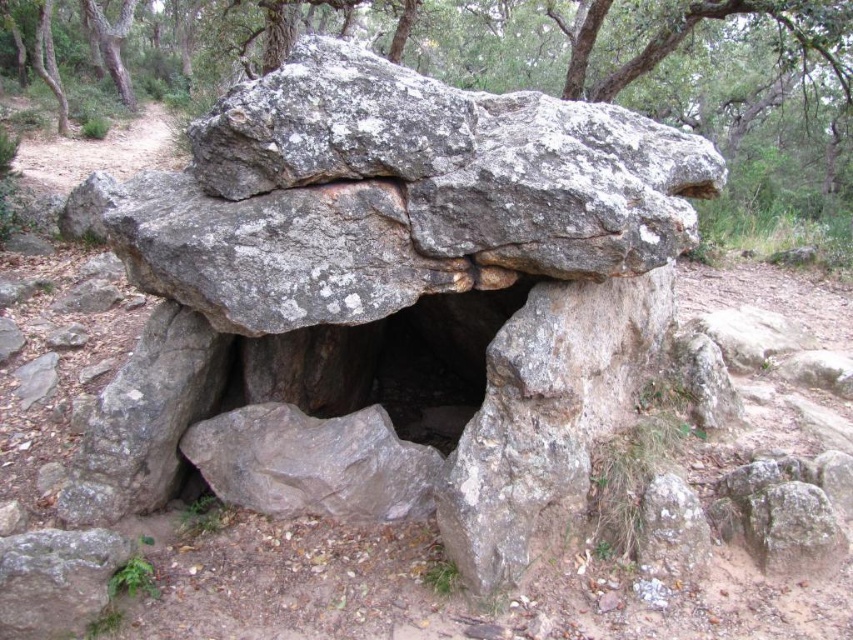
You are a geologist examining the dolmen structure. You notice two gray rough stone at center and gray rough rock at center. Which one is positioned lower in the structure?

The gray rough stone at center is positioned lower in the structure as it is located below the gray rough rock at center.

You are a hiker who wants to climb onto the gray rough stone at center to get a better view. Can you step onto it from the gray rough rock at center without needing a ladder?

The gray rough stone at center is not as tall as the gray rough rock at center, so you can step onto it from the gray rough rock at center without needing a ladder.